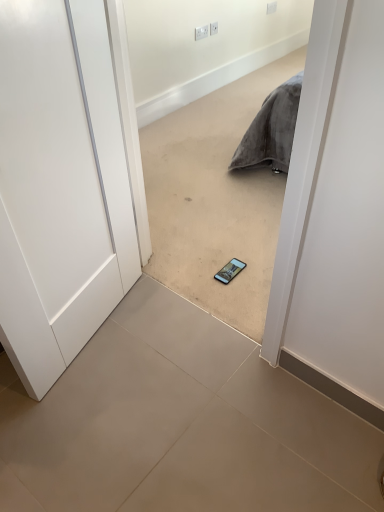
Find the location of a particular element. white plastic electric outlet at upper center, arranged as the first electric outlet when viewed from the right is located at coordinates (213, 28).

In order to face white matte door at left, should I rotate leftwards or rightwards?

Turn left approximately 17.817 degrees to face it.

Locate an element on the screen. smooth beige carpet at center is located at coordinates (215, 199).

What is the approximate height of smooth beige carpet at center?

It is 3.86 feet.

The width and height of the screenshot is (384, 512). Find the location of `white plastic electric outlet at upper center, which is the second electric outlet from left to right`. white plastic electric outlet at upper center, which is the second electric outlet from left to right is located at coordinates (213, 28).

From the image's perspective, would you say white plastic electric outlet at upper center, the second electric outlet in the right-to-left sequence, is shown under white matte door at left?

Actually, white plastic electric outlet at upper center, the second electric outlet in the right-to-left sequence, appears above white matte door at left in the image.

Are white plastic electric outlet at upper center, the second electric outlet in the right-to-left sequence, and white matte door at left far apart?

Yes, white plastic electric outlet at upper center, the second electric outlet in the right-to-left sequence, and white matte door at left are quite far apart.

Considering the relative positions of white plastic electric outlet at upper center, the second electric outlet in the right-to-left sequence, and white matte door at left in the image provided, is white plastic electric outlet at upper center, the second electric outlet in the right-to-left sequence, to the left or to the right of white matte door at left?

Based on their positions, white plastic electric outlet at upper center, the second electric outlet in the right-to-left sequence, is located to the right of white matte door at left.

Considering the sizes of white plastic electric outlet at upper center, the second electric outlet in the right-to-left sequence, and white matte door at left in the image, is white plastic electric outlet at upper center, the second electric outlet in the right-to-left sequence, taller or shorter than white matte door at left?

Result: Clearly, white plastic electric outlet at upper center, the second electric outlet in the right-to-left sequence, is shorter compared to white matte door at left.

Which point is more forward, (207, 198) or (116, 441)?

The point (116, 441) is closer to the camera.

Does smooth beige carpet at center have a lesser height compared to matte gray tile at center?

No, smooth beige carpet at center is not shorter than matte gray tile at center.

Where is `ceramic tile to the left of smooth beige carpet at center`? This screenshot has width=384, height=512. ceramic tile to the left of smooth beige carpet at center is located at coordinates (180, 425).

Is smooth beige carpet at center facing away from matte gray tile at center?

No, smooth beige carpet at center is not facing the opposite direction of matte gray tile at center.

From a real-world perspective, is smooth beige carpet at center physically located above or below white matte door at left?

smooth beige carpet at center is situated lower than white matte door at left in the real world.

Is smooth beige carpet at center situated inside white matte door at left or outside?

smooth beige carpet at center is located beyond the bounds of white matte door at left.

Which is in front, point (187, 210) or point (90, 18)?

The point (90, 18) is closer to the camera.

Is smooth beige carpet at center aimed at white matte door at left?

Yes, smooth beige carpet at center is turned towards white matte door at left.

Is point (203, 34) closer to viewer compared to point (157, 349)?

No, (203, 34) is behind (157, 349).

Considering the relative sizes of white plastic electric outlet at upper center, the second electric outlet in the right-to-left sequence, and matte gray tile at center in the image provided, is white plastic electric outlet at upper center, the second electric outlet in the right-to-left sequence, taller than matte gray tile at center?

Yes, white plastic electric outlet at upper center, the second electric outlet in the right-to-left sequence, is taller than matte gray tile at center.

Looking at this image, how much distance is there between white plastic electric outlet at upper center, the second electric outlet in the right-to-left sequence, and matte gray tile at center?

A distance of 9.05 feet exists between white plastic electric outlet at upper center, the second electric outlet in the right-to-left sequence, and matte gray tile at center.

From a real-world perspective, is smooth beige carpet at center positioned above or below white plastic electric outlet at upper center, arranged as the first electric outlet when viewed from the right?

Clearly, from a real-world perspective, smooth beige carpet at center is above white plastic electric outlet at upper center, arranged as the first electric outlet when viewed from the right.

Between smooth beige carpet at center and white plastic electric outlet at upper center, which is the second electric outlet from left to right, which one has smaller width?

Thinner between the two is white plastic electric outlet at upper center, which is the second electric outlet from left to right.

Considering the sizes of smooth beige carpet at center and white plastic electric outlet at upper center, arranged as the first electric outlet when viewed from the right, in the image, is smooth beige carpet at center bigger or smaller than white plastic electric outlet at upper center, arranged as the first electric outlet when viewed from the right,?

Considering their sizes, smooth beige carpet at center takes up more space than white plastic electric outlet at upper center, arranged as the first electric outlet when viewed from the right.

Looking at this image, is smooth beige carpet at center aimed at white plastic electric outlet at upper center, which is the second electric outlet from left to right?

No, smooth beige carpet at center is not facing towards white plastic electric outlet at upper center, which is the second electric outlet from left to right.

Between smooth beige carpet at center and white plastic electric outlet at upper center, the second electric outlet in the right-to-left sequence, which one has smaller width?

white plastic electric outlet at upper center, the second electric outlet in the right-to-left sequence.

In the scene shown: From a real-world perspective, is smooth beige carpet at center located higher than white plastic electric outlet at upper center, the second electric outlet in the right-to-left sequence?

Yes.

Is smooth beige carpet at center aimed at white plastic electric outlet at upper center, the second electric outlet in the right-to-left sequence?

No, smooth beige carpet at center is not turned towards white plastic electric outlet at upper center, the second electric outlet in the right-to-left sequence.

Considering the sizes of smooth beige carpet at center and white plastic electric outlet at upper center, which appears as the first electric outlet when viewed from the left, in the image, is smooth beige carpet at center bigger or smaller than white plastic electric outlet at upper center, which appears as the first electric outlet when viewed from the left,?

Clearly, smooth beige carpet at center is larger in size than white plastic electric outlet at upper center, which appears as the first electric outlet when viewed from the left.

Is white plastic electric outlet at upper center, arranged as the first electric outlet when viewed from the right, further to the viewer compared to smooth beige carpet at center?

Yes, white plastic electric outlet at upper center, arranged as the first electric outlet when viewed from the right, is further from the camera.

From the image's perspective, which is below, white plastic electric outlet at upper center, arranged as the first electric outlet when viewed from the right, or smooth beige carpet at center?

smooth beige carpet at center is shown below in the image.

How many degrees apart are the facing directions of white plastic electric outlet at upper center, which is the second electric outlet from left to right, and smooth beige carpet at center?

88.8 degrees.

Is white plastic electric outlet at upper center, which is the second electric outlet from left to right, beside smooth beige carpet at center?

No, white plastic electric outlet at upper center, which is the second electric outlet from left to right, is not making contact with smooth beige carpet at center.

This screenshot has height=512, width=384. What are the coordinates of `electric outlet that is the 1st object to the right of the white matte door at left, starting at the anchor` in the screenshot? It's located at (201, 32).

This screenshot has width=384, height=512. I want to click on concrete located above the matte gray tile at center (from the image's perspective), so click(x=215, y=199).

Considering their positions, is white plastic electric outlet at upper center, which appears as the first electric outlet when viewed from the left, positioned closer to smooth beige carpet at center than white plastic electric outlet at upper center, which is the second electric outlet from left to right?

white plastic electric outlet at upper center, which appears as the first electric outlet when viewed from the left, is positioned closer to the anchor smooth beige carpet at center.

Looking at the image, which one is located further to matte gray tile at center, white matte door at left or white plastic electric outlet at upper center, arranged as the first electric outlet when viewed from the right?

white plastic electric outlet at upper center, arranged as the first electric outlet when viewed from the right, lies further to matte gray tile at center than the other object.

Estimate the real-world distances between objects in this image. Which object is further from white matte door at left, smooth beige carpet at center or white plastic electric outlet at upper center, arranged as the first electric outlet when viewed from the right?

white plastic electric outlet at upper center, arranged as the first electric outlet when viewed from the right, is positioned further to the anchor white matte door at left.

From the image, which object appears to be farther from matte gray tile at center, white plastic electric outlet at upper center, arranged as the first electric outlet when viewed from the right, or white plastic electric outlet at upper center, the second electric outlet in the right-to-left sequence?

white plastic electric outlet at upper center, arranged as the first electric outlet when viewed from the right, is positioned further to the anchor matte gray tile at center.

When comparing their distances from white plastic electric outlet at upper center, the second electric outlet in the right-to-left sequence, does white plastic electric outlet at upper center, which is the second electric outlet from left to right, or white matte door at left seem closer?

white plastic electric outlet at upper center, which is the second electric outlet from left to right, is closer to white plastic electric outlet at upper center, the second electric outlet in the right-to-left sequence.

When comparing their distances from white plastic electric outlet at upper center, which appears as the first electric outlet when viewed from the left, does matte gray tile at center or white matte door at left seem closer?

white matte door at left lies closer to white plastic electric outlet at upper center, which appears as the first electric outlet when viewed from the left, than the other object.

From the image, which object appears to be farther from matte gray tile at center, white plastic electric outlet at upper center, which appears as the first electric outlet when viewed from the left, or white plastic electric outlet at upper center, which is the second electric outlet from left to right?

Among the two, white plastic electric outlet at upper center, which is the second electric outlet from left to right, is located further to matte gray tile at center.

Estimate the real-world distances between objects in this image. Which object is further from smooth beige carpet at center, white plastic electric outlet at upper center, arranged as the first electric outlet when viewed from the right, or white plastic electric outlet at upper center, which appears as the first electric outlet when viewed from the left?

white plastic electric outlet at upper center, arranged as the first electric outlet when viewed from the right.

Identify the location of ceramic tile positioned between smooth beige carpet at center and white plastic electric outlet at upper center, the second electric outlet in the right-to-left sequence, from near to far. tap(180, 425).

The image size is (384, 512). Identify the location of ceramic tile positioned between white matte door at left and white plastic electric outlet at upper center, the second electric outlet in the right-to-left sequence, from near to far. (180, 425).

Identify the location of ceramic tile between smooth beige carpet at center and white plastic electric outlet at upper center, which is the second electric outlet from left to right, along the z-axis. This screenshot has height=512, width=384. (180, 425).

In order to click on electric outlet between matte gray tile at center and white plastic electric outlet at upper center, arranged as the first electric outlet when viewed from the right, along the z-axis in this screenshot , I will do `click(201, 32)`.